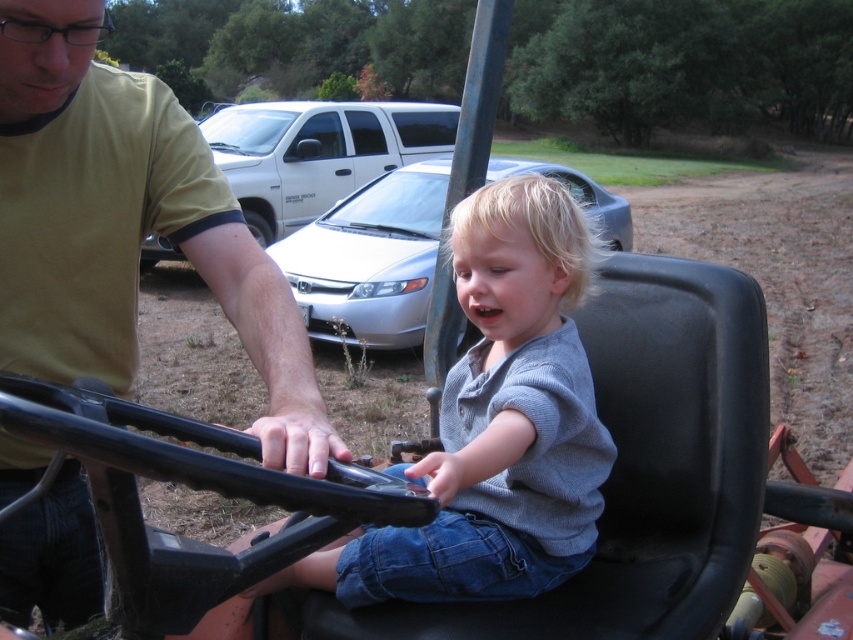
Is yellow matte shirt at upper left positioned before silver metallic sedan at center?

Yes, yellow matte shirt at upper left is closer to the viewer.

Is yellow matte shirt at upper left bigger than silver metallic sedan at center?

No, yellow matte shirt at upper left is not bigger than silver metallic sedan at center.

What do you see at coordinates (126, 227) in the screenshot?
I see `yellow matte shirt at upper left` at bounding box center [126, 227].

Locate an element on the screen. yellow matte shirt at upper left is located at coordinates (126, 227).

Does gray cotton shirt at center have a greater height compared to satin silver sedan at center?

Incorrect, gray cotton shirt at center's height is not larger of satin silver sedan at center's.

Who is higher up, gray cotton shirt at center or satin silver sedan at center?

satin silver sedan at center is higher up.

At what (x,y) coordinates should I click in order to perform the action: click on gray cotton shirt at center. Please return your answer as a coordinate pair (x, y). The width and height of the screenshot is (853, 640). Looking at the image, I should click on (496, 422).

Where is `gray cotton shirt at center`? The width and height of the screenshot is (853, 640). gray cotton shirt at center is located at coordinates (496, 422).

Is point (22, 108) in front of point (318, 241)?

Yes, it is.

Can you confirm if yellow matte shirt at upper left is positioned to the left of satin silver sedan at center?

In fact, yellow matte shirt at upper left is to the right of satin silver sedan at center.

Which is in front, point (158, 202) or point (397, 333)?

Point (158, 202) is more forward.

Image resolution: width=853 pixels, height=640 pixels. I want to click on yellow matte shirt at upper left, so click(126, 227).